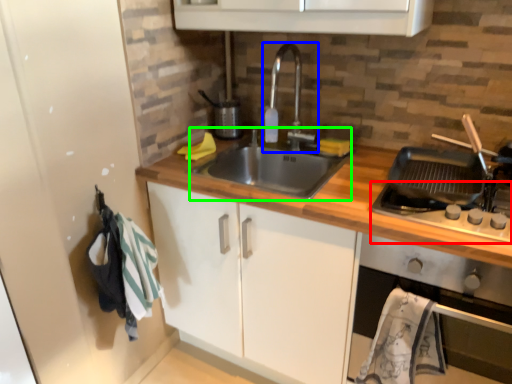
Question: Which is nearer to the gas stove (highlighted by a red box)? tap (highlighted by a blue box) or sink (highlighted by a green box).

Choices:
 (A) tap
 (B) sink

Answer: (B)